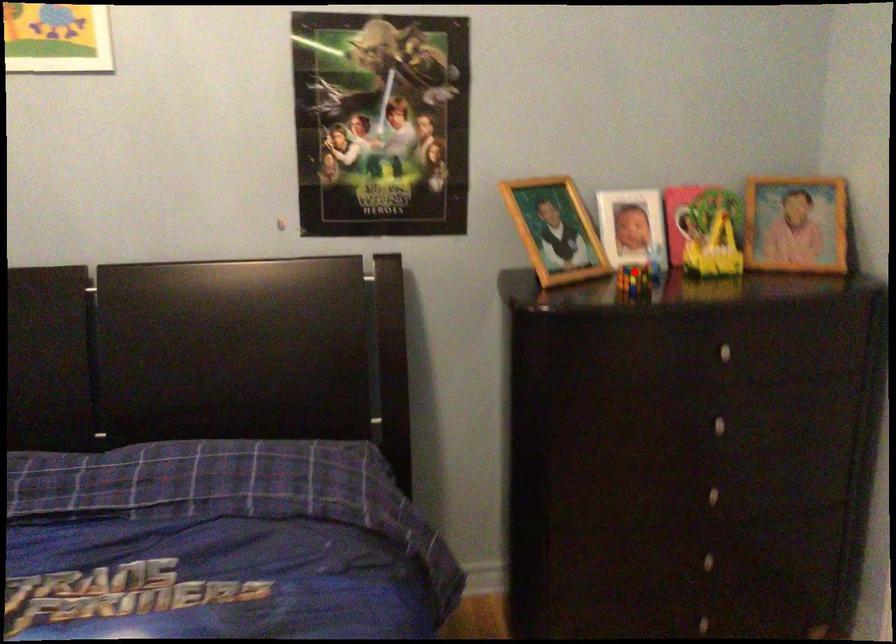
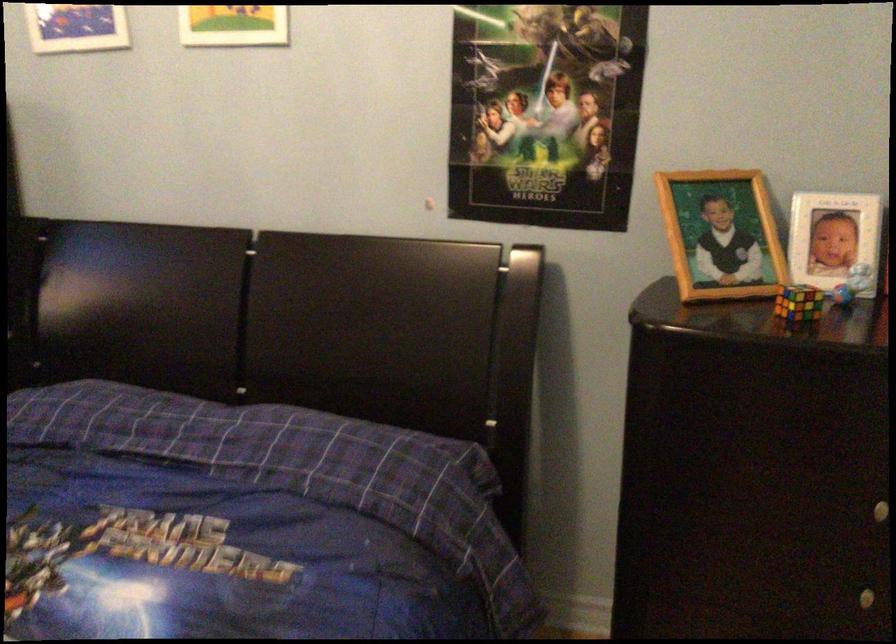
Find the pixel in the second image that matches the highlighted location in the first image.

(798, 303)